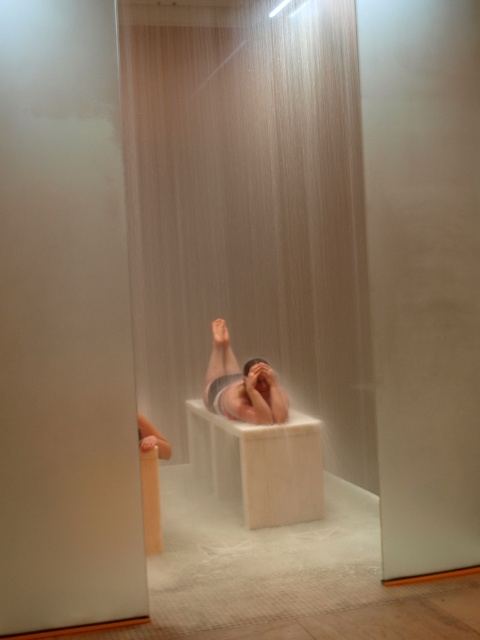
Question: Where is white matte bath at center located in relation to smooth skin man at center in the image?

Choices:
 (A) right
 (B) left

Answer: (B)

Question: Is white matte bath at center below smooth skin man at center?

Choices:
 (A) yes
 (B) no

Answer: (A)

Question: Where is white matte bath at center located in relation to smooth skin man at center in the image?

Choices:
 (A) above
 (B) below

Answer: (B)

Question: Among these points, which one is farthest from the camera?

Choices:
 (A) (319, 515)
 (B) (210, 360)

Answer: (B)